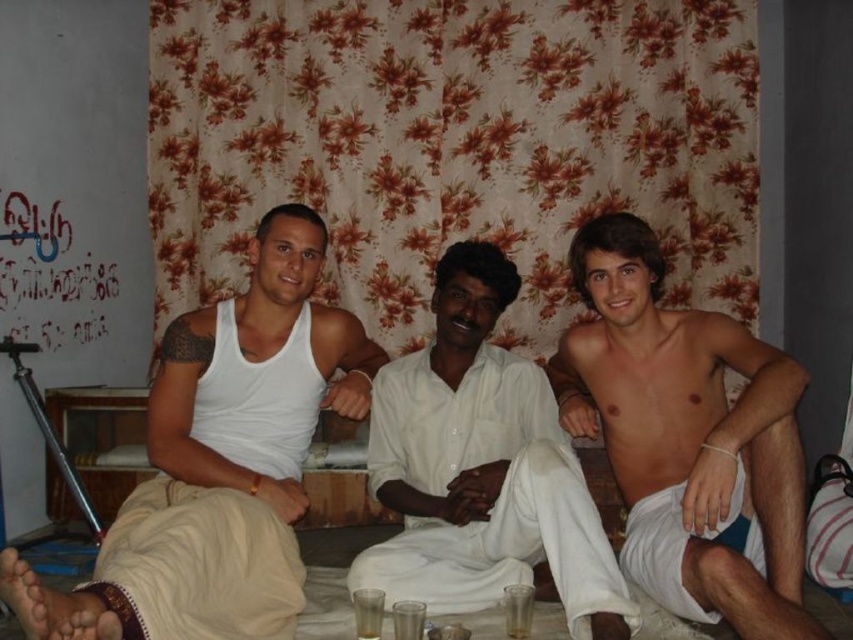
Question: Can you confirm if transparent plastic cup at lower center is smaller than clear glass at center?

Choices:
 (A) no
 (B) yes

Answer: (A)

Question: Can you confirm if transparent plastic cup at lower center is thinner than translucent glass at center?

Choices:
 (A) no
 (B) yes

Answer: (B)

Question: Estimate the real-world distances between objects in this image. Which object is farther from the shiny white shorts at right?

Choices:
 (A) white cotton shirt at center
 (B) translucent glass at center
 (C) transparent plastic cup at lower center

Answer: (B)

Question: Which object appears farthest from the camera in this image?

Choices:
 (A) clear glass at center
 (B) transparent plastic cup at lower center
 (C) white cotton shirt at center

Answer: (B)

Question: Can you confirm if white matte tank top at left is positioned above transparent plastic cup at lower center?

Choices:
 (A) yes
 (B) no

Answer: (A)

Question: Which point is farther to the camera?

Choices:
 (A) white matte tank top at left
 (B) white cotton shirt at center
 (C) transparent plastic cup at lower center

Answer: (C)